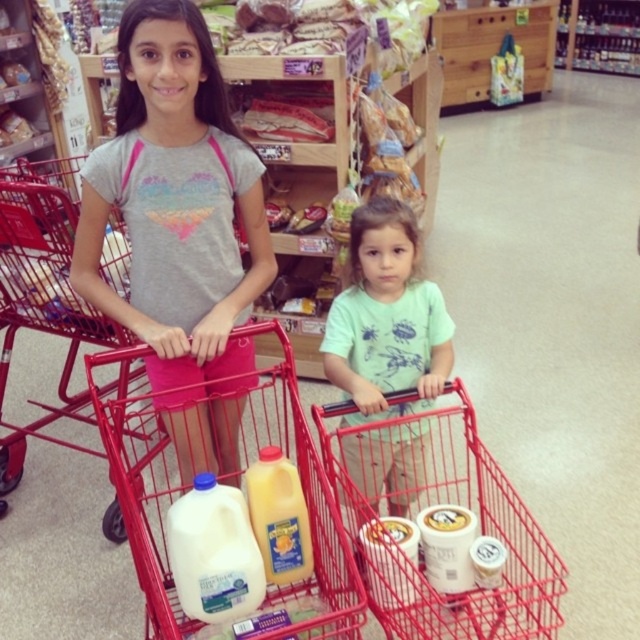
Question: Which object is farther from the camera taking this photo?

Choices:
 (A) green matte shirt at center
 (B) yellow matte plastic bottle at center
 (C) white matte yogurt at lower center
 (D) white plastic milk carton at center

Answer: (A)

Question: Is matte gray t-shirt at center positioned before white matte milk at lower center?

Choices:
 (A) yes
 (B) no

Answer: (B)

Question: Which point is closer to the camera?

Choices:
 (A) matte gray t-shirt at center
 (B) green matte shirt at center
 (C) red metal trolley at left

Answer: (A)

Question: Which of these objects is positioned farthest from the white matte yogurt at lower center?

Choices:
 (A) white matte milk at lower center
 (B) green matte shirt at center
 (C) yellow matte plastic bottle at center

Answer: (A)

Question: In this image, where is green matte shirt at center located relative to white matte milk at lower center?

Choices:
 (A) below
 (B) above

Answer: (B)

Question: Does matte gray t-shirt at center have a lesser width compared to white matte yogurt at lower center?

Choices:
 (A) yes
 (B) no

Answer: (B)